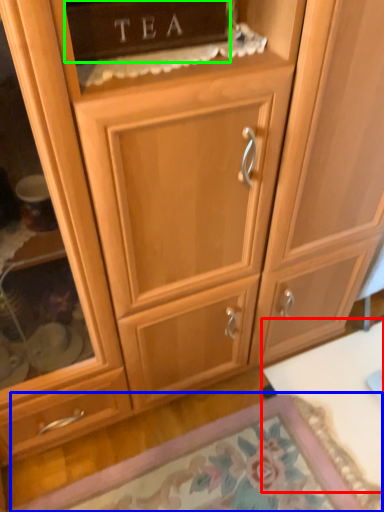
Question: Which is farther away from table (highlighted by a red box)? door (highlighted by a blue box) or cabinetry (highlighted by a green box)?

Choices:
 (A) door
 (B) cabinetry

Answer: (B)